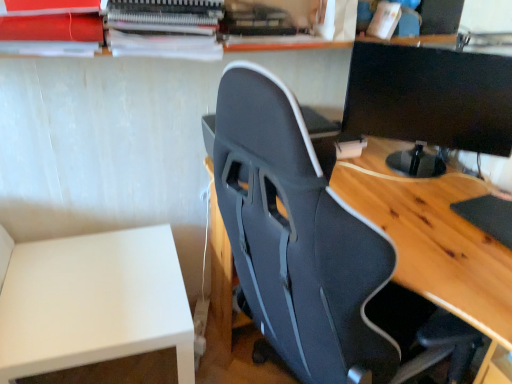
Question: Can you confirm if black glossy monitor at upper right is shorter than black fabric chair at center?

Choices:
 (A) yes
 (B) no

Answer: (A)

Question: Can you confirm if black glossy monitor at upper right is positioned to the left of black fabric chair at center?

Choices:
 (A) no
 (B) yes

Answer: (A)

Question: Is black fabric chair at center inside black glossy monitor at upper right?

Choices:
 (A) yes
 (B) no

Answer: (B)

Question: Is black glossy monitor at upper right wider than black fabric chair at center?

Choices:
 (A) yes
 (B) no

Answer: (B)

Question: Is black glossy monitor at upper right turned away from black fabric chair at center?

Choices:
 (A) yes
 (B) no

Answer: (B)

Question: Is black glossy monitor at upper right inside the boundaries of white matte table at lower left, or outside?

Choices:
 (A) inside
 (B) outside

Answer: (B)

Question: Is point (404, 165) closer or farther from the camera than point (96, 301)?

Choices:
 (A) farther
 (B) closer

Answer: (A)

Question: From the image's perspective, is black glossy monitor at upper right positioned above or below white matte table at lower left?

Choices:
 (A) above
 (B) below

Answer: (A)

Question: In terms of height, does black glossy monitor at upper right look taller or shorter compared to white matte table at lower left?

Choices:
 (A) short
 (B) tall

Answer: (A)

Question: Is black fabric chair at center wider or thinner than black glossy monitor at upper right?

Choices:
 (A) wide
 (B) thin

Answer: (A)

Question: In the image, is black fabric chair at center positioned in front of or behind black glossy monitor at upper right?

Choices:
 (A) behind
 (B) front

Answer: (B)

Question: Visually, is black fabric chair at center positioned to the left or to the right of black glossy monitor at upper right?

Choices:
 (A) left
 (B) right

Answer: (A)

Question: From the image's perspective, is black fabric chair at center positioned above or below black glossy monitor at upper right?

Choices:
 (A) below
 (B) above

Answer: (A)

Question: Is black glossy monitor at upper right bigger or smaller than black fabric chair at center?

Choices:
 (A) small
 (B) big

Answer: (A)

Question: Would you say black glossy monitor at upper right is inside or outside black fabric chair at center?

Choices:
 (A) outside
 (B) inside

Answer: (A)